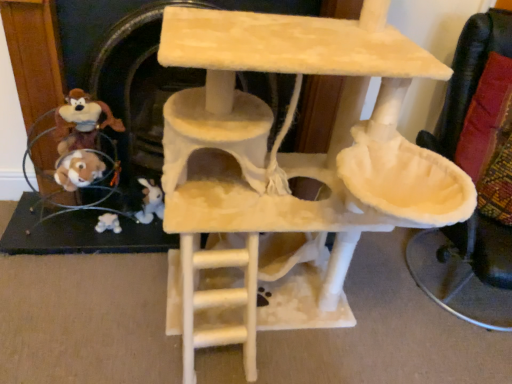
Question: Is brown plush toy at left, which is the 1th toy in front-to-back order, shorter than beige felt cat tree at center?

Choices:
 (A) no
 (B) yes

Answer: (B)

Question: From the image's perspective, is brown plush toy at left, which is the first toy in top-to-bottom order, under beige felt cat tree at center?

Choices:
 (A) no
 (B) yes

Answer: (A)

Question: From a real-world perspective, is brown plush toy at left, positioned as the 2th toy in bottom-to-top order, on beige felt cat tree at center?

Choices:
 (A) yes
 (B) no

Answer: (B)

Question: Would you consider brown plush toy at left, which ranks as the 2th toy in back-to-front order, to be distant from beige felt cat tree at center?

Choices:
 (A) yes
 (B) no

Answer: (B)

Question: Can beige felt cat tree at center be found inside brown plush toy at left, which is the 1th toy in front-to-back order?

Choices:
 (A) no
 (B) yes

Answer: (A)

Question: From the image's perspective, relative to beige felt cat tree at center, is white plush toy at lower left, the 1th toy from the back, above or below?

Choices:
 (A) above
 (B) below

Answer: (B)

Question: Considering the positions of white plush toy at lower left, which is the second toy in front-to-back order, and beige felt cat tree at center in the image, is white plush toy at lower left, which is the second toy in front-to-back order, wider or thinner than beige felt cat tree at center?

Choices:
 (A) wide
 (B) thin

Answer: (B)

Question: From their relative heights in the image, would you say white plush toy at lower left, placed as the 2th toy when sorted from top to bottom, is taller or shorter than beige felt cat tree at center?

Choices:
 (A) short
 (B) tall

Answer: (A)

Question: Choose the correct answer: Is white plush toy at lower left, placed as the 2th toy when sorted from top to bottom, inside beige felt cat tree at center or outside it?

Choices:
 (A) outside
 (B) inside

Answer: (A)

Question: Choose the correct answer: Is beige felt fireplace at center inside brown plush toy at left, which is the 1th toy in front-to-back order, or outside it?

Choices:
 (A) inside
 (B) outside

Answer: (B)

Question: Is beige felt fireplace at center taller or shorter than brown plush toy at left, which is the first toy in top-to-bottom order?

Choices:
 (A) short
 (B) tall

Answer: (B)

Question: Based on their sizes in the image, would you say beige felt fireplace at center is bigger or smaller than brown plush toy at left, which is the first toy in top-to-bottom order?

Choices:
 (A) small
 (B) big

Answer: (B)

Question: Would you say beige felt fireplace at center is to the left or to the right of brown plush toy at left, which is the 1th toy in front-to-back order, in the picture?

Choices:
 (A) left
 (B) right

Answer: (B)

Question: Considering the positions of point (281, 29) and point (113, 223), is point (281, 29) closer or farther from the camera than point (113, 223)?

Choices:
 (A) closer
 (B) farther

Answer: (A)

Question: From the image's perspective, relative to white plush toy at lower left, the 1th toy from the back, is beige felt cat tree at center above or below?

Choices:
 (A) above
 (B) below

Answer: (A)